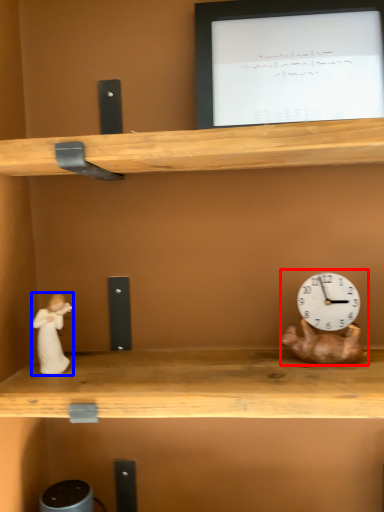
Question: Which object is further to the camera taking this photo, toy (highlighted by a red box) or couple (highlighted by a blue box)?

Choices:
 (A) toy
 (B) couple

Answer: (B)